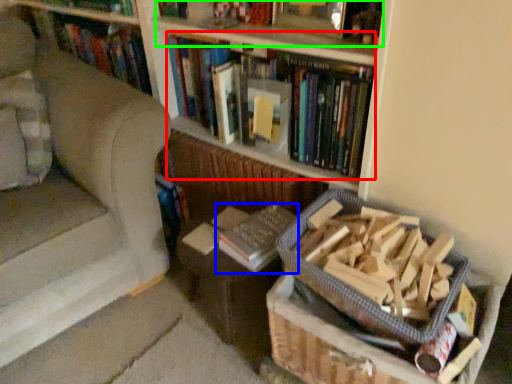
Question: Estimate the real-world distances between objects in this image. Which object is farther from book (highlighted by a red box), book (highlighted by a blue box) or book (highlighted by a green box)?

Choices:
 (A) book
 (B) book

Answer: (A)